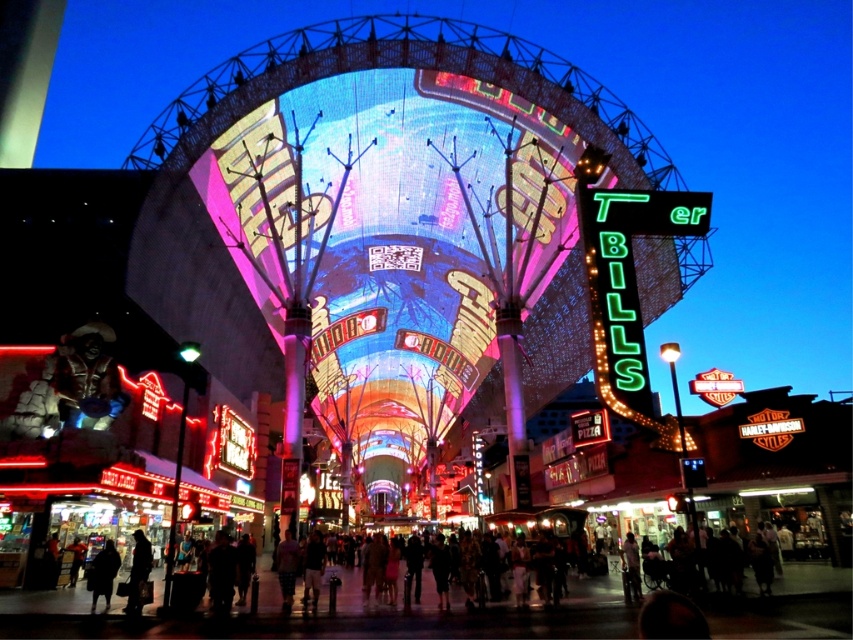
Question: Which of the following is the closest to the observer?

Choices:
 (A) dark wool coat at lower left
 (B) dark clothing at lower left

Answer: (A)

Question: Considering the relative positions of dark clothing at lower left and dark wool coat at lower left in the image provided, where is dark clothing at lower left located with respect to dark wool coat at lower left?

Choices:
 (A) below
 (B) above

Answer: (A)

Question: Does dark clothing at lower left lie behind dark wool coat at lower left?

Choices:
 (A) yes
 (B) no

Answer: (A)

Question: Is dark clothing at lower left smaller than dark wool coat at lower left?

Choices:
 (A) yes
 (B) no

Answer: (B)